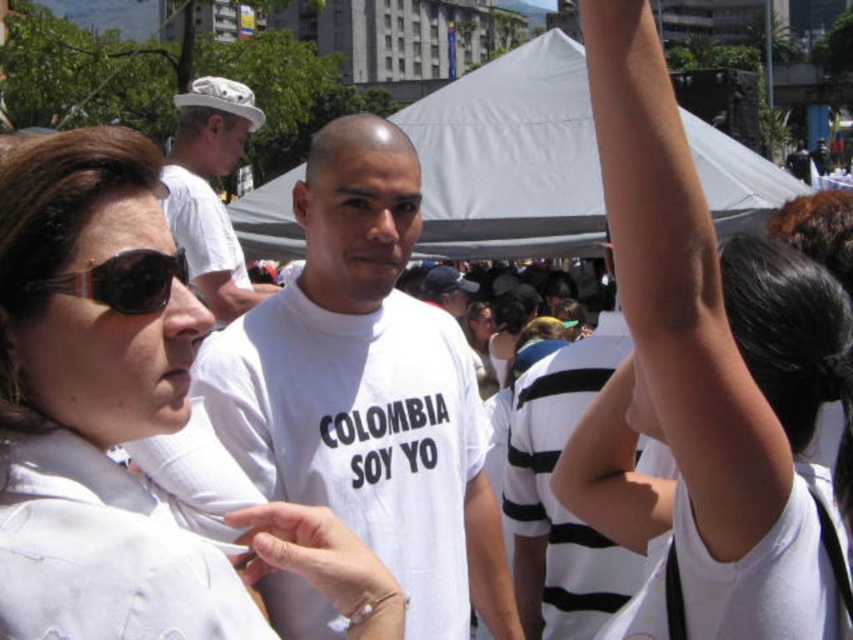
Question: Can you confirm if white matte shirt at center is positioned to the left of white cotton t-shirt at center?

Choices:
 (A) no
 (B) yes

Answer: (B)

Question: Is white fabric canopy at center below white matte hat at upper left?

Choices:
 (A) no
 (B) yes

Answer: (B)

Question: Which point is closer to the camera?

Choices:
 (A) white matte hat at upper left
 (B) white matte arm at upper right
 (C) white cotton t-shirt at center

Answer: (B)

Question: Is the position of white matte shirt at center more distant than that of white matte hat at upper left?

Choices:
 (A) no
 (B) yes

Answer: (A)

Question: Among these objects, which one is nearest to the camera?

Choices:
 (A) white matte shirt at center
 (B) white cotton t-shirt at center
 (C) white matte arm at upper right
 (D) black plastic sunglasses at upper left

Answer: (A)

Question: Which point is farther from the camera taking this photo?

Choices:
 (A) (132, 433)
 (B) (584, 38)
 (C) (200, 99)

Answer: (C)